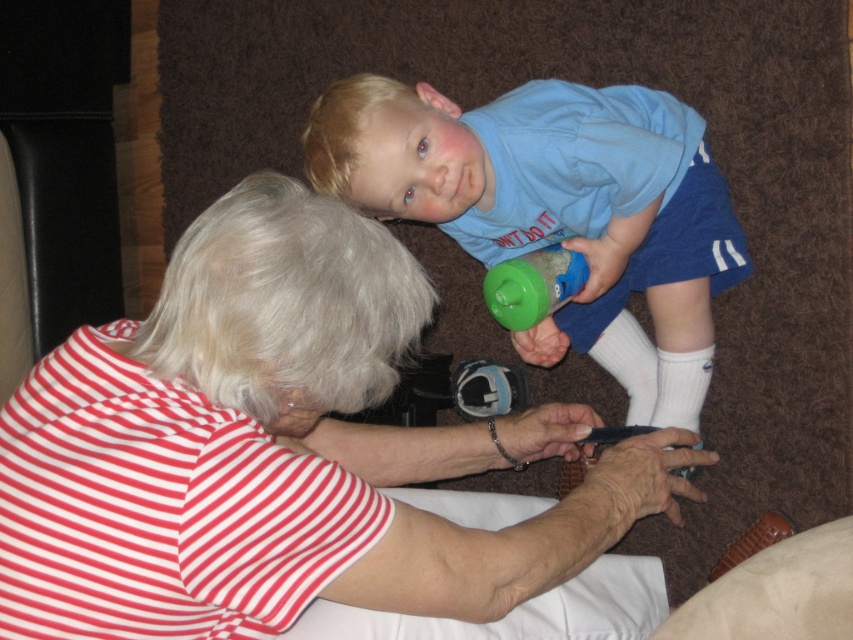
Question: Which point is closer to the camera?

Choices:
 (A) blue cotton shirt at upper center
 (B) green plastic sippy cup at center

Answer: (A)

Question: Which object is farther from the camera taking this photo?

Choices:
 (A) green plastic sippy cup at center
 (B) striped cotton shirt at center
 (C) blue cotton shirt at upper center

Answer: (A)

Question: Which object is farther from the camera taking this photo?

Choices:
 (A) blue cotton shirt at upper center
 (B) striped cotton shirt at center

Answer: (A)

Question: Does blue cotton shirt at upper center have a smaller size compared to green plastic sippy cup at center?

Choices:
 (A) no
 (B) yes

Answer: (A)

Question: Is striped cotton shirt at center wider than green plastic sippy cup at center?

Choices:
 (A) no
 (B) yes

Answer: (B)

Question: Is blue cotton shirt at upper center bigger than green plastic sippy cup at center?

Choices:
 (A) yes
 (B) no

Answer: (A)